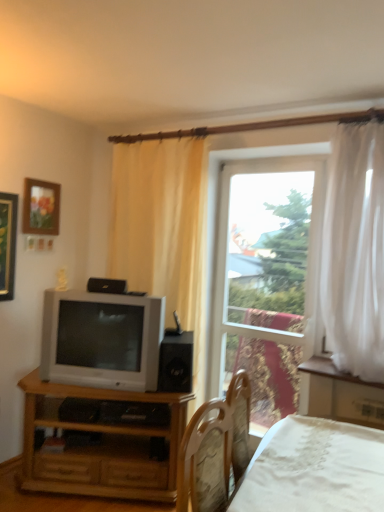
Locate an element on the screen. light brown wood tv stand at lower left is located at coordinates (101, 446).

This screenshot has height=512, width=384. What do you see at coordinates (268, 280) in the screenshot?
I see `transparent glass window at center` at bounding box center [268, 280].

The image size is (384, 512). Find the location of `white lace bed at lower right`. white lace bed at lower right is located at coordinates click(315, 468).

Considering the positions of objects light brown wood tv stand at lower left and transparent glass window at center in the image provided, who is more to the left, light brown wood tv stand at lower left or transparent glass window at center?

light brown wood tv stand at lower left.

Is point (119, 395) positioned behind point (311, 268)?

That is False.

How many degrees apart are the facing directions of light brown wood tv stand at lower left and transparent glass window at center?

The angle between the facing direction of light brown wood tv stand at lower left and the facing direction of transparent glass window at center is 29.4 degrees.

How different are the orientations of white sheer curtain at right and light brown wood tv stand at lower left in degrees?

27.9 degrees separate the facing orientations of white sheer curtain at right and light brown wood tv stand at lower left.

At what (x,y) coordinates should I click in order to perform the action: click on desk that appears behind the white sheer curtain at right. Please return your answer as a coordinate pair (x, y). Looking at the image, I should click on pos(101,446).

Does point (332, 238) come in front of point (26, 438)?

That is True.

Is white sheer curtain at right oriented away from matte silver television at left?

No.

Considering the relative positions of white sheer curtain at right and matte silver television at left in the image provided, is white sheer curtain at right to the left or to the right of matte silver television at left?

Clearly, white sheer curtain at right is on the right of matte silver television at left in the image.

Is white sheer curtain at right touching white lace bed at lower right?

No, white sheer curtain at right is not beside white lace bed at lower right.

Does white sheer curtain at right come behind white lace bed at lower right?

Yes, it is behind white lace bed at lower right.

Considering the sizes of objects white sheer curtain at right and white lace bed at lower right in the image provided, who is taller, white sheer curtain at right or white lace bed at lower right?

white sheer curtain at right is taller.

Between black matte speaker at center and matte silver television at left, which one is positioned in front?

matte silver television at left.

From the image's perspective, which is above, black matte speaker at center or matte silver television at left?

matte silver television at left appears higher in the image.

From a real-world perspective, is black matte speaker at center on top of matte silver television at left?

No, from a real-world perspective, black matte speaker at center is not on top of matte silver television at left.

Between black matte speaker at center and matte silver television at left, which one has smaller width?

With smaller width is matte silver television at left.

In the scene shown: Can you confirm if transparent glass window at center is bigger than matte silver television at left?

No.

Is transparent glass window at center thinner than matte silver television at left?

Indeed, transparent glass window at center has a lesser width compared to matte silver television at left.

Could you tell me if transparent glass window at center is facing matte silver television at left?

No, transparent glass window at center does not turn towards matte silver television at left.

Consider the image. Which object is positioned more to the right, transparent glass window at center or matte silver television at left?

Positioned to the right is transparent glass window at center.

From a real-world perspective, between transparent glass window at center and wooden framed picture at upper left, who is vertically lower?

transparent glass window at center, from a real-world perspective.

Are transparent glass window at center and wooden framed picture at upper left beside each other?

No, transparent glass window at center is not making contact with wooden framed picture at upper left.

Would you say transparent glass window at center is inside or outside wooden framed picture at upper left?

transparent glass window at center cannot be found inside wooden framed picture at upper left.

What are the coordinates of `window below the wooden framed picture at upper left (from a real-world perspective)` in the screenshot? It's located at (268, 280).

Image resolution: width=384 pixels, height=512 pixels. Find the location of `window lying on the right of light brown wood tv stand at lower left`. window lying on the right of light brown wood tv stand at lower left is located at coordinates (268, 280).

This screenshot has height=512, width=384. In order to click on curtain that appears above the light brown wood tv stand at lower left (from the image's perspective) in this screenshot , I will do `click(355, 251)`.

Considering their positions, is transparent glass window at center positioned further to light brown wood tv stand at lower left than white sheer curtain at right?

white sheer curtain at right is further to light brown wood tv stand at lower left.

When comparing their distances from white lace bed at lower right, does transparent glass window at center or light brown wood tv stand at lower left seem closer?

Based on the image, light brown wood tv stand at lower left appears to be nearer to white lace bed at lower right.

When comparing their distances from black matte speaker at center, does matte silver television at left or transparent glass window at center seem closer?

matte silver television at left is closer to black matte speaker at center.

Considering their positions, is white sheer curtain at right positioned closer to wooden framed picture at upper left than light brown wood tv stand at lower left?

light brown wood tv stand at lower left is closer to wooden framed picture at upper left.

Which object lies nearer to the anchor point light brown wood tv stand at lower left, transparent glass window at center or matte silver television at left?

matte silver television at left.

From the image, which object appears to be farther from light brown wood tv stand at lower left, black matte speaker at center or white lace bed at lower right?

Based on the image, white lace bed at lower right appears to be further to light brown wood tv stand at lower left.

Based on their spatial positions, is transparent glass window at center or matte silver television at left closer to white sheer curtain at right?

transparent glass window at center lies closer to white sheer curtain at right than the other object.

Looking at the image, which one is located further to matte silver television at left, wooden framed picture at upper left or transparent glass window at center?

Among the two, transparent glass window at center is located further to matte silver television at left.

Find the location of a particular element. The height and width of the screenshot is (512, 384). desk located between white lace bed at lower right and wooden framed picture at upper left in the depth direction is located at coordinates (101, 446).

In order to click on television between wooden framed picture at upper left and white sheer curtain at right in this screenshot , I will do `click(102, 339)`.

The height and width of the screenshot is (512, 384). I want to click on window located between wooden framed picture at upper left and white sheer curtain at right in the left-right direction, so click(268, 280).

Identify the location of curtain positioned between white lace bed at lower right and transparent glass window at center from near to far. (355, 251).